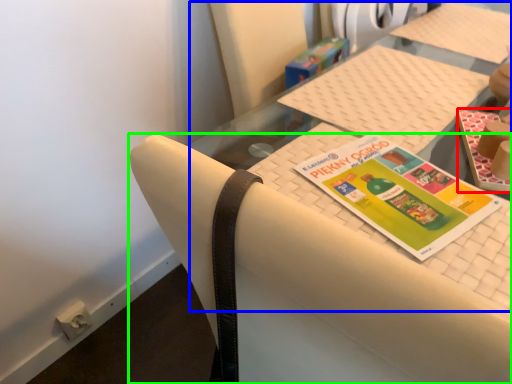
Question: Considering the real-world distances, which object is farthest from book (highlighted by a red box)? tablecloth (highlighted by a blue box) or chair (highlighted by a green box)?

Choices:
 (A) tablecloth
 (B) chair

Answer: (B)